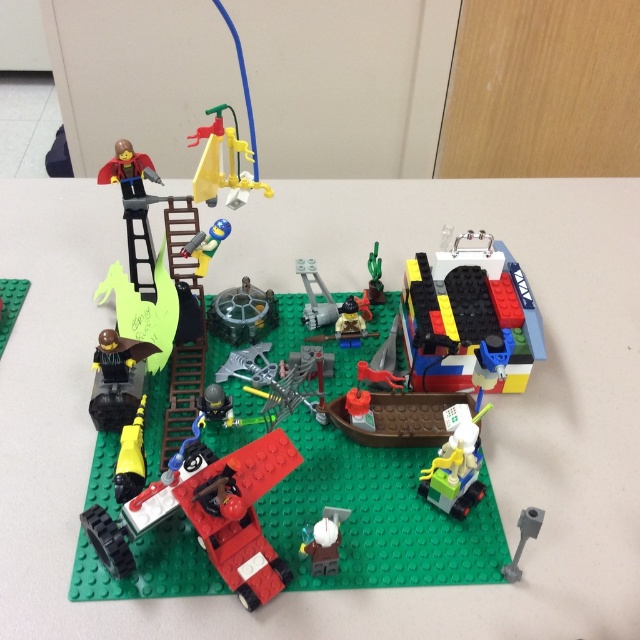
In the Lego diorama, there are two objects at the center of the scene. Which one is positioned to the left, the white matte candle at center or the green matte cactus at center?

The white matte candle at center is positioned to the left of the green matte cactus at center.